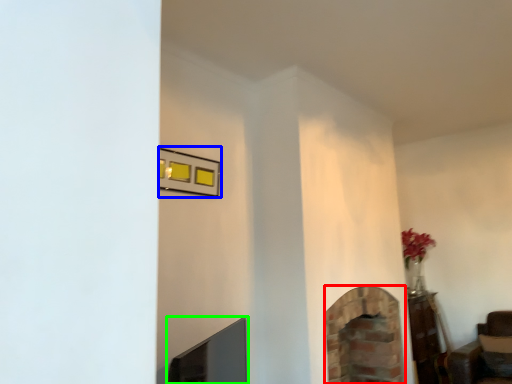
Question: Considering the real-world distances, which object is closest to fireplace (highlighted by a red box)? picture frame (highlighted by a blue box) or fireplace (highlighted by a green box).

Choices:
 (A) picture frame
 (B) fireplace

Answer: (B)